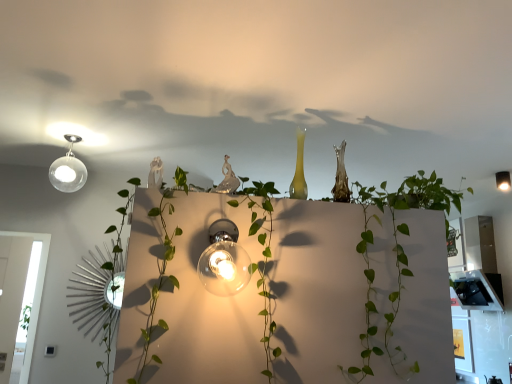
Find the location of a particular element. This screenshot has height=384, width=512. translucent glass bulb at center, which is the first lamp in bottom-to-top order is located at coordinates (224, 260).

The width and height of the screenshot is (512, 384). Describe the element at coordinates (224, 260) in the screenshot. I see `translucent glass bulb at center, the 1th lamp when ordered from left to right` at that location.

This screenshot has width=512, height=384. What do you see at coordinates (503, 180) in the screenshot?
I see `matte glass bulb at upper right, which is counted as the 2th lamp, starting from the front` at bounding box center [503, 180].

The image size is (512, 384). Identify the location of matte glass bulb at upper right, which appears as the 2th lamp when ordered from the bottom. (503, 180).

You are a GUI agent. You are given a task and a screenshot of the screen. Output one action in this format:
    pyautogui.click(x=<x>, y=<y>)
    Task: Click on the translucent glass bulb at center, which appears as the 2th lamp when viewed from the top
    This screenshot has height=384, width=512.
    Given the screenshot: What is the action you would take?
    pyautogui.click(x=224, y=260)

Which is more to the right, matte glass bulb at upper right, which appears as the 2th lamp when ordered from the bottom, or translucent glass bulb at center, the 1th lamp positioned from the front?

matte glass bulb at upper right, which appears as the 2th lamp when ordered from the bottom.

Which object is further away from the camera, matte glass bulb at upper right, which is counted as the 2th lamp, starting from the front, or translucent glass bulb at center, which appears as the 2th lamp when viewed from the top?

matte glass bulb at upper right, which is counted as the 2th lamp, starting from the front.

Which point is more forward, (509, 186) or (240, 263)?

Point (240, 263)

From the image's perspective, is matte glass bulb at upper right, marked as the 2th lamp in a left-to-right arrangement, located above translucent glass bulb at center, which is the first lamp in bottom-to-top order?

Correct, matte glass bulb at upper right, marked as the 2th lamp in a left-to-right arrangement, appears higher than translucent glass bulb at center, which is the first lamp in bottom-to-top order, in the image.

From a real-world perspective, who is located higher, matte glass bulb at upper right, the 1th lamp in the top-to-bottom sequence, or translucent glass bulb at center, the 1th lamp when ordered from left to right?

matte glass bulb at upper right, the 1th lamp in the top-to-bottom sequence, from a real-world perspective.

Which of these two, matte glass bulb at upper right, which ranks as the 1th lamp in back-to-front order, or translucent glass bulb at center, the 1th lamp when ordered from left to right, is wider?

Wider between the two is translucent glass bulb at center, the 1th lamp when ordered from left to right.

Who is taller, matte glass bulb at upper right, which appears as the 2th lamp when ordered from the bottom, or translucent glass bulb at center, the 1th lamp when ordered from left to right?

Standing taller between the two is translucent glass bulb at center, the 1th lamp when ordered from left to right.

Considering the sizes of objects matte glass bulb at upper right, which ranks as the 1th lamp in back-to-front order, and translucent glass bulb at center, which is the first lamp in bottom-to-top order, in the image provided, who is smaller, matte glass bulb at upper right, which ranks as the 1th lamp in back-to-front order, or translucent glass bulb at center, which is the first lamp in bottom-to-top order,?

Smaller between the two is matte glass bulb at upper right, which ranks as the 1th lamp in back-to-front order.

From the picture: Do you think matte glass bulb at upper right, placed as the first lamp when sorted from right to left, is within translucent glass bulb at center, placed as the second lamp when sorted from right to left, or outside of it?

matte glass bulb at upper right, placed as the first lamp when sorted from right to left, is not enclosed by translucent glass bulb at center, placed as the second lamp when sorted from right to left.

Is matte glass bulb at upper right, which is counted as the 2th lamp, starting from the front, touching translucent glass bulb at center, placed as the second lamp when sorted from right to left?

matte glass bulb at upper right, which is counted as the 2th lamp, starting from the front, and translucent glass bulb at center, placed as the second lamp when sorted from right to left, are clearly separated.

Is matte glass bulb at upper right, the 1th lamp in the top-to-bottom sequence, turned away from translucent glass bulb at center, the 1th lamp positioned from the front?

No, translucent glass bulb at center, the 1th lamp positioned from the front, is not at the back of matte glass bulb at upper right, the 1th lamp in the top-to-bottom sequence.

What's the angular difference between matte glass bulb at upper right, which appears as the 2th lamp when ordered from the bottom, and translucent glass bulb at center, the 1th lamp positioned from the front,'s facing directions?

92 degrees separate the facing orientations of matte glass bulb at upper right, which appears as the 2th lamp when ordered from the bottom, and translucent glass bulb at center, the 1th lamp positioned from the front.

The height and width of the screenshot is (384, 512). In the image, there is a translucent glass bulb at center, which appears as the 2th lamp when viewed from the top. Identify the location of lamp above it (from the image's perspective). (503, 180).

Based on their positions, is translucent glass bulb at center, which is the first lamp in bottom-to-top order, located to the left or right of matte glass bulb at upper right, marked as the 2th lamp in a left-to-right arrangement?

Clearly, translucent glass bulb at center, which is the first lamp in bottom-to-top order, is on the left of matte glass bulb at upper right, marked as the 2th lamp in a left-to-right arrangement, in the image.

Does translucent glass bulb at center, arranged as the 2th lamp when viewed from the back, come behind matte glass bulb at upper right, marked as the 2th lamp in a left-to-right arrangement?

No, the depth of translucent glass bulb at center, arranged as the 2th lamp when viewed from the back, is less than that of matte glass bulb at upper right, marked as the 2th lamp in a left-to-right arrangement.

Considering the positions of points (237, 236) and (501, 182), is point (237, 236) closer to camera compared to point (501, 182)?

Yes, it is.

From the image's perspective, who appears lower, translucent glass bulb at center, arranged as the 2th lamp when viewed from the back, or matte glass bulb at upper right, which ranks as the 1th lamp in back-to-front order?

translucent glass bulb at center, arranged as the 2th lamp when viewed from the back, from the image's perspective.

From a real-world perspective, is translucent glass bulb at center, the 1th lamp positioned from the front, physically above matte glass bulb at upper right, which ranks as the 1th lamp in back-to-front order?

Incorrect, from a real-world perspective, translucent glass bulb at center, the 1th lamp positioned from the front, is lower than matte glass bulb at upper right, which ranks as the 1th lamp in back-to-front order.

Looking at their sizes, would you say translucent glass bulb at center, which is the first lamp in bottom-to-top order, is wider or thinner than matte glass bulb at upper right, which appears as the 2th lamp when ordered from the bottom?

translucent glass bulb at center, which is the first lamp in bottom-to-top order, is wider than matte glass bulb at upper right, which appears as the 2th lamp when ordered from the bottom.

Which of these two, translucent glass bulb at center, the 1th lamp when ordered from left to right, or matte glass bulb at upper right, which is counted as the 2th lamp, starting from the front, stands shorter?

Standing shorter between the two is matte glass bulb at upper right, which is counted as the 2th lamp, starting from the front.

Is translucent glass bulb at center, which appears as the 2th lamp when viewed from the top, bigger than matte glass bulb at upper right, which appears as the 2th lamp when ordered from the bottom?

Correct, translucent glass bulb at center, which appears as the 2th lamp when viewed from the top, is larger in size than matte glass bulb at upper right, which appears as the 2th lamp when ordered from the bottom.

Looking at this image, is matte glass bulb at upper right, which appears as the 2th lamp when ordered from the bottom, a part of translucent glass bulb at center, which is the first lamp in bottom-to-top order?

No, matte glass bulb at upper right, which appears as the 2th lamp when ordered from the bottom, is not inside translucent glass bulb at center, which is the first lamp in bottom-to-top order.

Is translucent glass bulb at center, placed as the second lamp when sorted from right to left, next to matte glass bulb at upper right, which appears as the 2th lamp when ordered from the bottom, and touching it?

There is a gap between translucent glass bulb at center, placed as the second lamp when sorted from right to left, and matte glass bulb at upper right, which appears as the 2th lamp when ordered from the bottom.

Is translucent glass bulb at center, which appears as the 2th lamp when viewed from the top, turned away from matte glass bulb at upper right, the 1th lamp in the top-to-bottom sequence?

No, translucent glass bulb at center, which appears as the 2th lamp when viewed from the top, is not facing away from matte glass bulb at upper right, the 1th lamp in the top-to-bottom sequence.

Could you measure the distance between translucent glass bulb at center, which appears as the 2th lamp when viewed from the top, and matte glass bulb at upper right, marked as the 2th lamp in a left-to-right arrangement?

2.58 meters.

At what (x,y) coordinates should I click in order to perform the action: click on lamp above the translucent glass bulb at center, arranged as the 2th lamp when viewed from the back (from a real-world perspective). Please return your answer as a coordinate pair (x, y). The image size is (512, 384). Looking at the image, I should click on (503, 180).

Identify the location of lamp behind the translucent glass bulb at center, the 1th lamp positioned from the front. (503, 180).

The height and width of the screenshot is (384, 512). What are the coordinates of `lamp below the matte glass bulb at upper right, marked as the 2th lamp in a left-to-right arrangement (from the image's perspective)` in the screenshot? It's located at (224, 260).